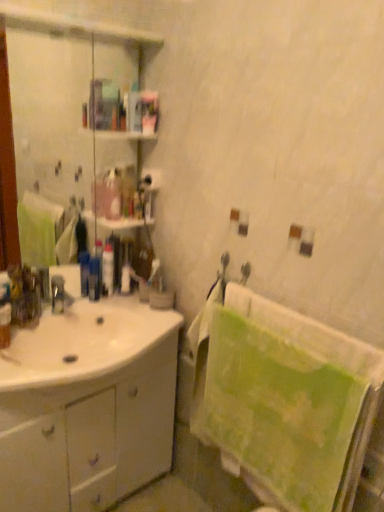
Locate an element on the screen. Image resolution: width=384 pixels, height=512 pixels. clear glass mirror at upper left is located at coordinates (54, 119).

Locate an element on the screen. The image size is (384, 512). white glossy sink at lower left is located at coordinates (83, 342).

Where is `blue plastic toothbrush at center, which ranks as the 3th toiletry in right-to-left order`? blue plastic toothbrush at center, which ranks as the 3th toiletry in right-to-left order is located at coordinates (94, 278).

The image size is (384, 512). What do you see at coordinates (107, 269) in the screenshot? I see `white glossy bottle at center, which is the second toiletry from left to right` at bounding box center [107, 269].

In order to face white matte toilet paper at upper center, should I rotate leftwards or rightwards?

Answer: Rotate your view left by about 6.030°.

What do you see at coordinates (126, 270) in the screenshot? This screenshot has width=384, height=512. I see `translucent plastic bottle at center, the 3th toiletry positioned from the left` at bounding box center [126, 270].

You are a GUI agent. You are given a task and a screenshot of the screen. Output one action in this format:
    pyautogui.click(x=<x>, y=<y>)
    Task: Click on the clear glass mirror at upper left
    This screenshot has width=384, height=512.
    Given the screenshot: What is the action you would take?
    pyautogui.click(x=54, y=119)

Does white glossy sink at lower left lie in front of blue plastic toothbrush at center, which ranks as the 3th toiletry in right-to-left order?

Yes, it is in front of blue plastic toothbrush at center, which ranks as the 3th toiletry in right-to-left order.

Based on the photo, who is bigger, white glossy sink at lower left or blue plastic toothbrush at center, which ranks as the 3th toiletry in right-to-left order?

white glossy sink at lower left.

Considering the positions of objects matte silver faucet at center and white glossy sink at lower left in the image provided, who is more to the left, matte silver faucet at center or white glossy sink at lower left?

matte silver faucet at center.

You are a GUI agent. You are given a task and a screenshot of the screen. Output one action in this format:
    pyautogui.click(x=<x>, y=<y>)
    Task: Click on the sink in front of the matte silver faucet at center
    Image resolution: width=384 pixels, height=512 pixels.
    Given the screenshot: What is the action you would take?
    pyautogui.click(x=83, y=342)

From the image's perspective, is matte silver faucet at center positioned above or below white glossy sink at lower left?

From the image's perspective, matte silver faucet at center appears above white glossy sink at lower left.

Is translucent plastic bottle at center, the 1th toiletry positioned from the right, not near matte silver faucet at center?

That's not correct — translucent plastic bottle at center, the 1th toiletry positioned from the right, is a little close to matte silver faucet at center.

From the picture: Is translucent plastic bottle at center, the 1th toiletry positioned from the right, looking in the opposite direction of matte silver faucet at center?

No, translucent plastic bottle at center, the 1th toiletry positioned from the right, is not facing away from matte silver faucet at center.

In the image, is translucent plastic bottle at center, the 3th toiletry positioned from the left, positioned in front of or behind matte silver faucet at center?

In the image, translucent plastic bottle at center, the 3th toiletry positioned from the left, appears behind matte silver faucet at center.

Does clear glass mirror at upper left contain translucent plastic bottle at center, the 3th toiletry positioned from the left?

That's correct, translucent plastic bottle at center, the 3th toiletry positioned from the left, is inside clear glass mirror at upper left.

Are clear glass mirror at upper left and translucent plastic bottle at center, the 1th toiletry positioned from the right, far apart?

Indeed, clear glass mirror at upper left is not near translucent plastic bottle at center, the 1th toiletry positioned from the right.

Can you confirm if clear glass mirror at upper left is bigger than translucent plastic bottle at center, the 3th toiletry positioned from the left?

Yes, clear glass mirror at upper left is bigger than translucent plastic bottle at center, the 3th toiletry positioned from the left.

In the scene shown: Can you tell me how much clear glass mirror at upper left and translucent plastic bottle at center, the 1th toiletry positioned from the right, differ in facing direction?

There is a 43.8-degree angle between the facing directions of clear glass mirror at upper left and translucent plastic bottle at center, the 1th toiletry positioned from the right.

From the image's perspective, who appears lower, green textured towel at right or white matte toilet paper at upper center?

From the image's view, green textured towel at right is below.

Which is in front, point (323, 426) or point (146, 177)?

Positioned in front is point (323, 426).

Considering the positions of objects green textured towel at right and white matte toilet paper at upper center in the image provided, who is more to the right, green textured towel at right or white matte toilet paper at upper center?

From the viewer's perspective, green textured towel at right appears more on the right side.

Is blue plastic toothbrush at center, which ranks as the 3th toiletry in right-to-left order, far away from translucent plastic bottle at center, the 1th toiletry positioned from the right?

blue plastic toothbrush at center, which ranks as the 3th toiletry in right-to-left order, is actually quite close to translucent plastic bottle at center, the 1th toiletry positioned from the right.

Between blue plastic toothbrush at center, which ranks as the 3th toiletry in right-to-left order, and translucent plastic bottle at center, the 1th toiletry positioned from the right, which one has larger width?

translucent plastic bottle at center, the 1th toiletry positioned from the right, is wider.

Is blue plastic toothbrush at center, the 1th toiletry viewed from the left, aimed at translucent plastic bottle at center, the 3th toiletry positioned from the left?

No, blue plastic toothbrush at center, the 1th toiletry viewed from the left, is not turned towards translucent plastic bottle at center, the 3th toiletry positioned from the left.

Which of these two, translucent plastic bottle at center, the 1th toiletry positioned from the right, or white glossy bottle at center, which is the second toiletry from left to right, is thinner?

white glossy bottle at center, which is the second toiletry from left to right, is thinner.

Considering their positions, is translucent plastic bottle at center, the 3th toiletry positioned from the left, located in front of or behind white glossy bottle at center, which is the second toiletry from left to right?

translucent plastic bottle at center, the 3th toiletry positioned from the left, is positioned farther from the viewer than white glossy bottle at center, which is the second toiletry from left to right.

From a real-world perspective, between translucent plastic bottle at center, the 1th toiletry positioned from the right, and white glossy bottle at center, marked as the second toiletry in a right-to-left arrangement, who is vertically lower?

translucent plastic bottle at center, the 1th toiletry positioned from the right, is physically lower.

Which is more to the left, translucent plastic bottle at center, the 3th toiletry positioned from the left, or white glossy bottle at center, which is the second toiletry from left to right?

white glossy bottle at center, which is the second toiletry from left to right, is more to the left.

From the white glossy sink at lower left, count 1st toiletrys backward and point to it. Please provide its 2D coordinates.

[(94, 278)]

Identify the location of tap lying on the left of white glossy sink at lower left. (59, 295).

Which object lies further to the anchor point blue plastic toothbrush at center, the 1th toiletry viewed from the left, white glossy bottle at center, which is the second toiletry from left to right, or matte silver faucet at center?

matte silver faucet at center lies further to blue plastic toothbrush at center, the 1th toiletry viewed from the left, than the other object.

When comparing their distances from white glossy bottle at center, which is the second toiletry from left to right, does clear glass mirror at upper left or white glossy sink at lower left seem closer?

white glossy sink at lower left is positioned closer to the anchor white glossy bottle at center, which is the second toiletry from left to right.

Considering their positions, is white glossy sink at lower left positioned further to white glossy bottle at center, marked as the second toiletry in a right-to-left arrangement, than green textured towel at right?

Among the two, green textured towel at right is located further to white glossy bottle at center, marked as the second toiletry in a right-to-left arrangement.

Based on their spatial positions, is green textured towel at right or white matte toilet paper at upper center further from blue plastic toothbrush at center, which ranks as the 3th toiletry in right-to-left order?

Among the two, green textured towel at right is located further to blue plastic toothbrush at center, which ranks as the 3th toiletry in right-to-left order.

Based on their spatial positions, is green textured towel at right or clear glass mirror at upper left closer to white glossy sink at lower left?

green textured towel at right is closer to white glossy sink at lower left.

Considering their positions, is white glossy cabinet at left positioned closer to green textured towel at right than white glossy bottle at center, which is the second toiletry from left to right?

white glossy cabinet at left is positioned closer to the anchor green textured towel at right.

Looking at the image, which one is located further to blue plastic toothbrush at center, the 1th toiletry viewed from the left, white glossy bottle at center, which is the second toiletry from left to right, or clear glass mirror at upper left?

Based on the image, clear glass mirror at upper left appears to be further to blue plastic toothbrush at center, the 1th toiletry viewed from the left.

Based on their spatial positions, is translucent plastic bottle at center, the 3th toiletry positioned from the left, or clear glass mirror at upper left closer to white glossy cabinet at left?

translucent plastic bottle at center, the 3th toiletry positioned from the left, is closer to white glossy cabinet at left.

The image size is (384, 512). Find the location of `mirror between matte silver faucet at center and green textured towel at right`. mirror between matte silver faucet at center and green textured towel at right is located at coordinates (54, 119).

Image resolution: width=384 pixels, height=512 pixels. I want to click on tap between clear glass mirror at upper left and white glossy sink at lower left from top to bottom, so click(59, 295).

The height and width of the screenshot is (512, 384). I want to click on tap between white matte toilet paper at upper center and white glossy cabinet at left vertically, so click(59, 295).

You are a GUI agent. You are given a task and a screenshot of the screen. Output one action in this format:
    pyautogui.click(x=<x>, y=<y>)
    Task: Click on the tap between blue plastic toothbrush at center, the 1th toiletry viewed from the left, and white glossy cabinet at left vertically
    The height and width of the screenshot is (512, 384).
    Given the screenshot: What is the action you would take?
    pyautogui.click(x=59, y=295)